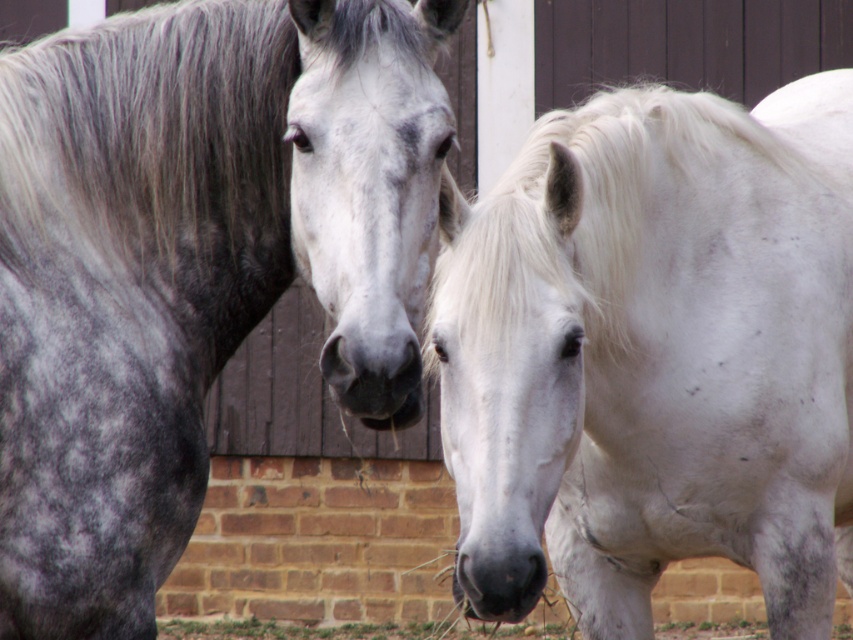
You are standing in a stable and see two horses. One is a dapple gray horse on the left and the other is a white matte horse at center. You want to place a hay bale exactly at point (654, 355). Which horse will the hay bale be closest to?

The point (654, 355) corresponds to the white matte horse at center, so the hay bale will be closest to the white matte horse at center.

You are a farmer checking the stalls. You need to move the speckled gray coat at left and the gray silky mane at center to separate stalls. If the stalls are 1.2 meters wide, can both fit individually without overlapping?

The speckled gray coat at left might be wider than gray silky mane at center. Since the stalls are 1.2 meters wide, the speckled gray coat at left may not fit if it exceeds 1.2 meters in width, while the gray silky mane at center might fit if it is narrower. However, without exact measurements, it is uncertain if both will fit individually without overlapping.